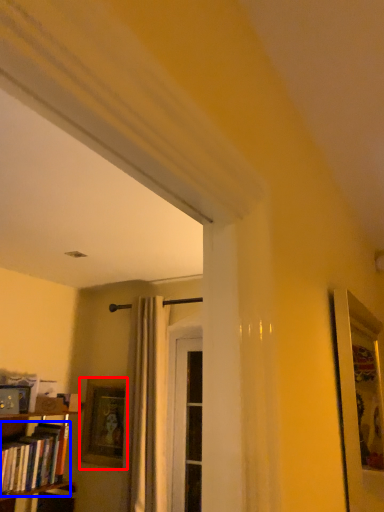
Question: Which of the following is the farthest to the observer, picture frame (highlighted by a red box) or book (highlighted by a blue box)?

Choices:
 (A) picture frame
 (B) book

Answer: (A)